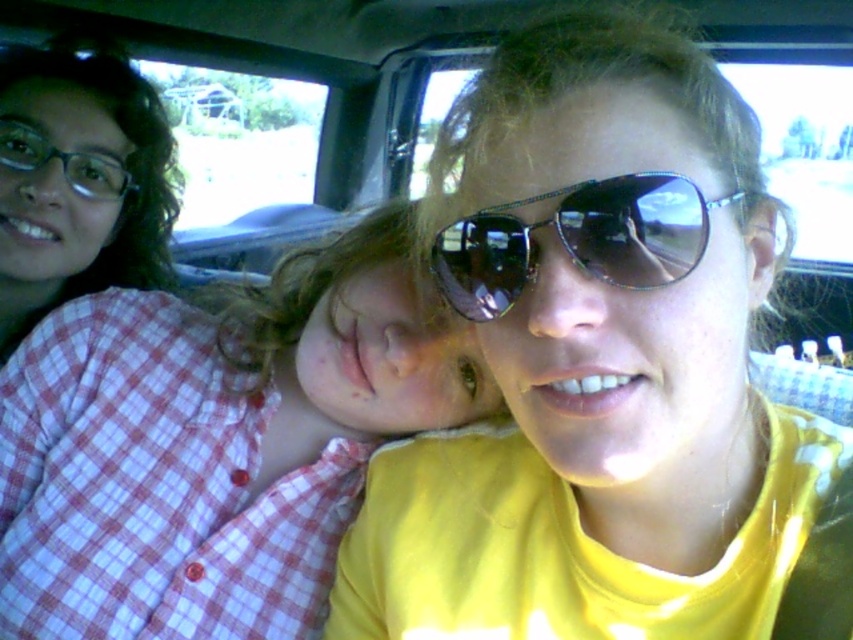
You are a passenger in the vehicle and want to know if the point at coordinate (250, 417) is closer to the front of the vehicle compared to the point at (144, 248). Based on the scene description, can you determine which point is closer to the front?

Point (250, 417) is in front of point (144, 248), so it is closer to the front of the vehicle.

You are a photographer trying to capture a clear shot of the checkered fabric shirt at left and the matte black glasses at upper left. Since you want to focus on the shirt, which object should you adjust your camera focus to prioritize? Please explain your reasoning based on their sizes.

The checkered fabric shirt at left has a larger size compared to matte black glasses at upper left, so you should prioritize focusing on the checkered fabric shirt at left because it is bigger and more prominent in the frame.